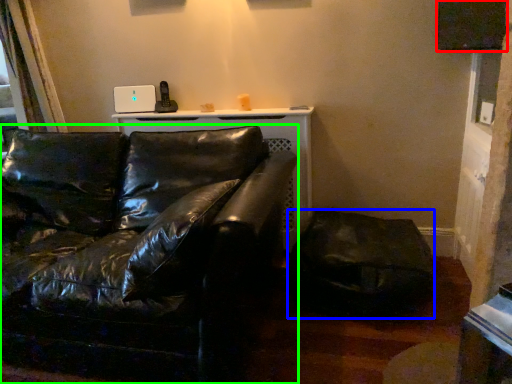
Question: Which object is positioned farthest from window screen (highlighted by a red box)? Select from swivel chair (highlighted by a blue box) and studio couch (highlighted by a green box).

Choices:
 (A) swivel chair
 (B) studio couch

Answer: (B)